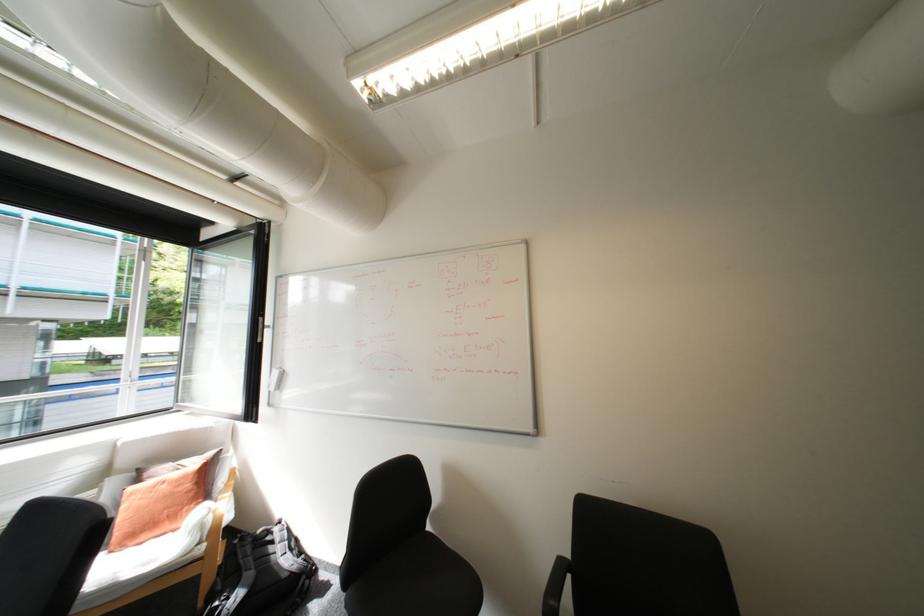
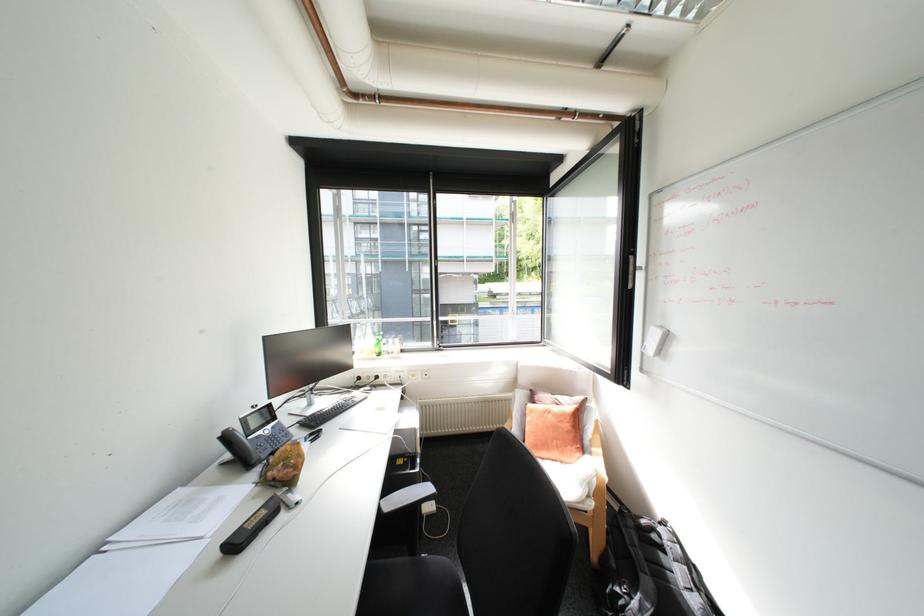
Where in the second image is the point corresponding to (175,485) from the first image?

(561, 416)